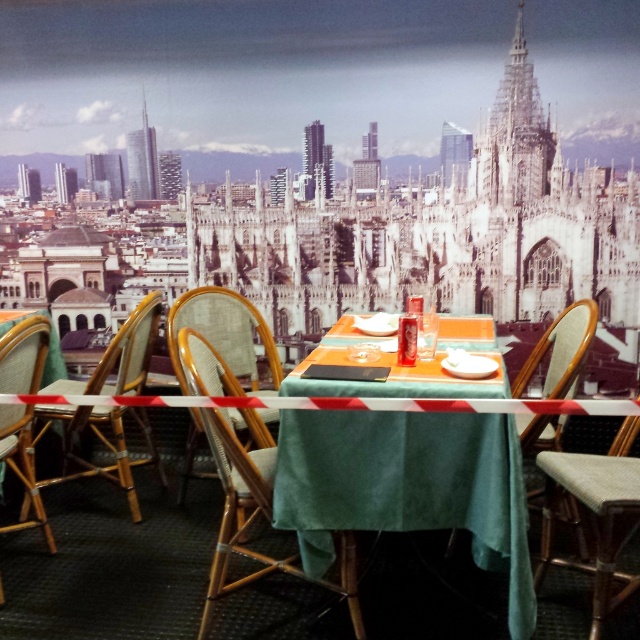
Is point (38, 419) closer to viewer compared to point (545, 396)?

Yes, point (38, 419) is closer to viewer.

Between point (113, 449) and point (586, 321), which one is positioned in front?

Point (586, 321) is in front.

Locate an element on the screen. This screenshot has height=640, width=640. rattan chair at left is located at coordinates (102, 442).

Is green velvet table at center wider than woven wood chair at center?

Yes, green velvet table at center is wider than woven wood chair at center.

Between point (499, 568) and point (216, 595), which one is positioned in front?

Positioned in front is point (499, 568).

I want to click on green velvet table at center, so click(406, 486).

Is woven wood chair at center above wooden chair at right?

Incorrect, woven wood chair at center is not positioned above wooden chair at right.

This screenshot has height=640, width=640. What do you see at coordinates (257, 509) in the screenshot?
I see `woven wood chair at center` at bounding box center [257, 509].

Is point (216, 426) positioned after point (556, 362)?

That is False.

Locate an element on the screen. This screenshot has width=640, height=640. woven wood chair at center is located at coordinates (257, 509).